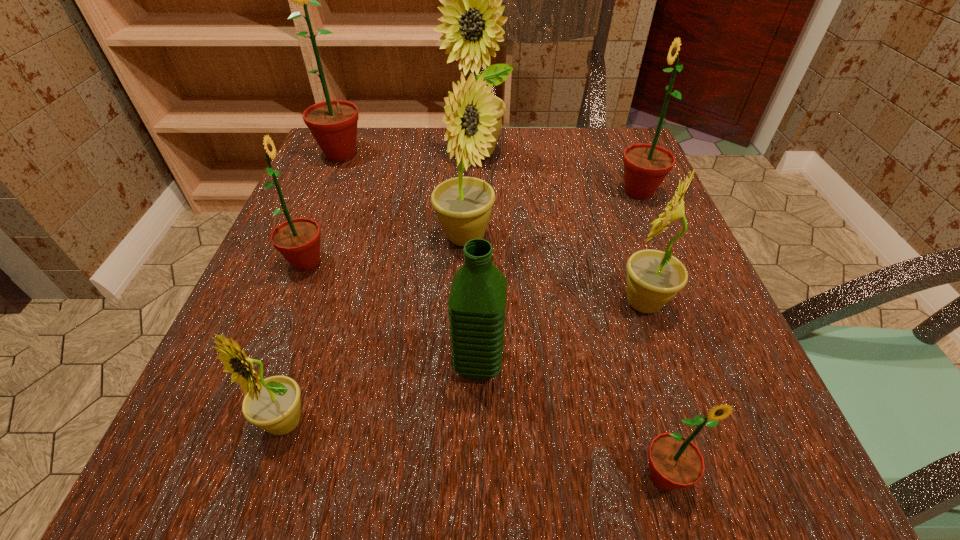
Image resolution: width=960 pixels, height=540 pixels. I want to click on yellow sunflower that is the closest one to the eighth farthest object, so click(x=463, y=204).

Select which yellow sunflower appears as the closest to the second nearest green sunflower. Please provide its 2D coordinates. Your answer should be formatted as a tuple, i.e. [(x, y)], where the tuple contains the x and y coordinates of a point satisfying the conditions above.

[(463, 204)]

Identify which green sunflower is the closest to the third farthest yellow sunflower. Please provide its 2D coordinates. Your answer should be formatted as a tuple, i.e. [(x, y)], where the tuple contains the x and y coordinates of a point satisfying the conditions above.

[(675, 462)]

The width and height of the screenshot is (960, 540). I want to click on green sunflower that can be found as the fourth closest to the second biggest yellow sunflower, so click(x=675, y=462).

Image resolution: width=960 pixels, height=540 pixels. In order to click on free space that satisfies the following two spatial constraints: 1. on the face of the fourth nearest object; 2. on the face of the nearest yellow sunflower in this screenshot , I will do `click(684, 422)`.

Where is `vacant region that satisfies the following two spatial constraints: 1. on the face of the third farthest green sunflower; 2. on the right side of the seventh farthest object`? This screenshot has height=540, width=960. vacant region that satisfies the following two spatial constraints: 1. on the face of the third farthest green sunflower; 2. on the right side of the seventh farthest object is located at coordinates (267, 364).

You are a GUI agent. You are given a task and a screenshot of the screen. Output one action in this format:
    pyautogui.click(x=<x>, y=<y>)
    Task: Click on the free point that satisfies the following two spatial constraints: 1. on the face of the biggest yellow sunflower; 2. on the face of the third nearest yellow sunflower
    The width and height of the screenshot is (960, 540).
    Given the screenshot: What is the action you would take?
    click(473, 238)

This screenshot has width=960, height=540. Find the location of `free space that satisfies the following two spatial constraints: 1. on the face of the biggest yellow sunflower; 2. on the face of the third biggest green sunflower`. free space that satisfies the following two spatial constraints: 1. on the face of the biggest yellow sunflower; 2. on the face of the third biggest green sunflower is located at coordinates (473, 262).